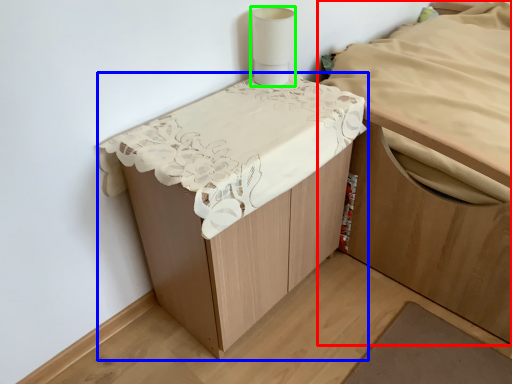
Question: Estimate the real-world distances between objects in this image. Which object is farther from furniture (highlighted by a red box), furniture (highlighted by a blue box) or lamp (highlighted by a green box)?

Choices:
 (A) furniture
 (B) lamp

Answer: (B)